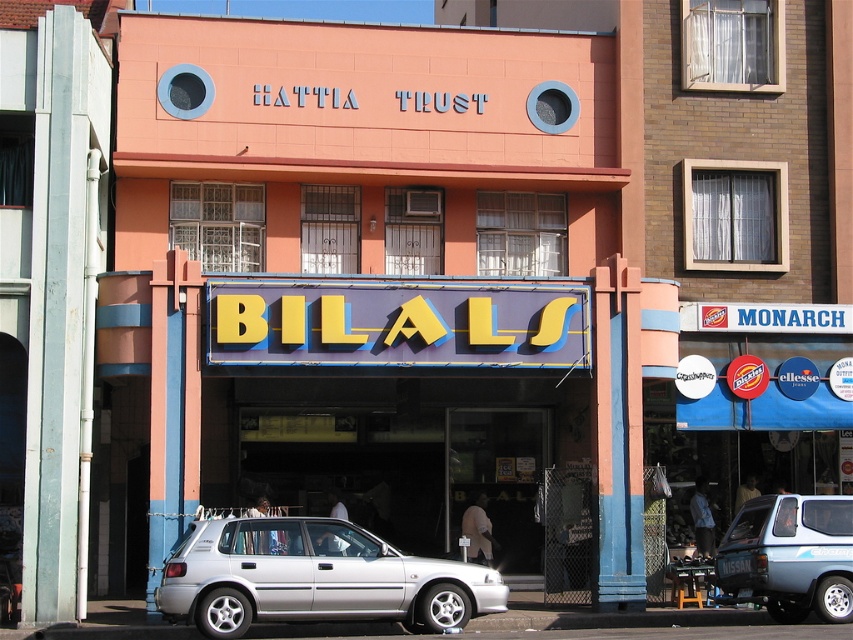
You are standing at the entrance of the BILALS storefront and want to park your car, which is a silver metallic hatchback at lower center. The parking spot is located at point (314, 579). Can you safely park your car there?

The point (314, 579) indicates the location of the silver metallic hatchback at lower center, so you can safely park your car there.

In the scene shown: You are a delivery person trying to park your 1.5 meter tall delivery robot between the silver metallic hatchback at lower center and the blue metallic hatchback at lower right. Can the robot fit vertically between them based on their heights?

The silver metallic hatchback at lower center has a lesser height compared to blue metallic hatchback at lower right. Since the robot is 1.5 meters tall, it can fit vertically between them as the space between them would accommodate its height.

You are standing at the entrance of the BILALS storefront and want to walk towards the point labeled point (364, 570). Will you pass by the point labeled point (784, 557) on your way?

Yes, since point (364, 570) is in front of point (784, 557), you will pass by point (784, 557) on your way to point (364, 570).